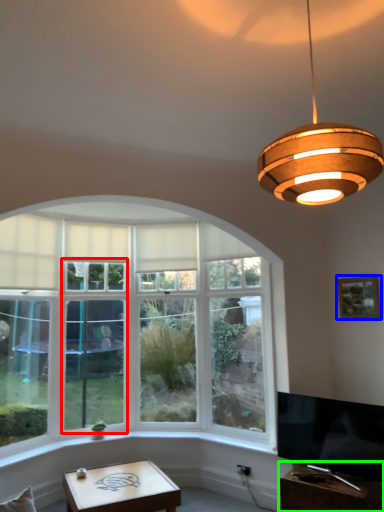
Question: Estimate the real-world distances between objects in this image. Which object is farther from glass door (highlighted by a red box), picture frame (highlighted by a blue box) or table (highlighted by a green box)?

Choices:
 (A) picture frame
 (B) table

Answer: (A)